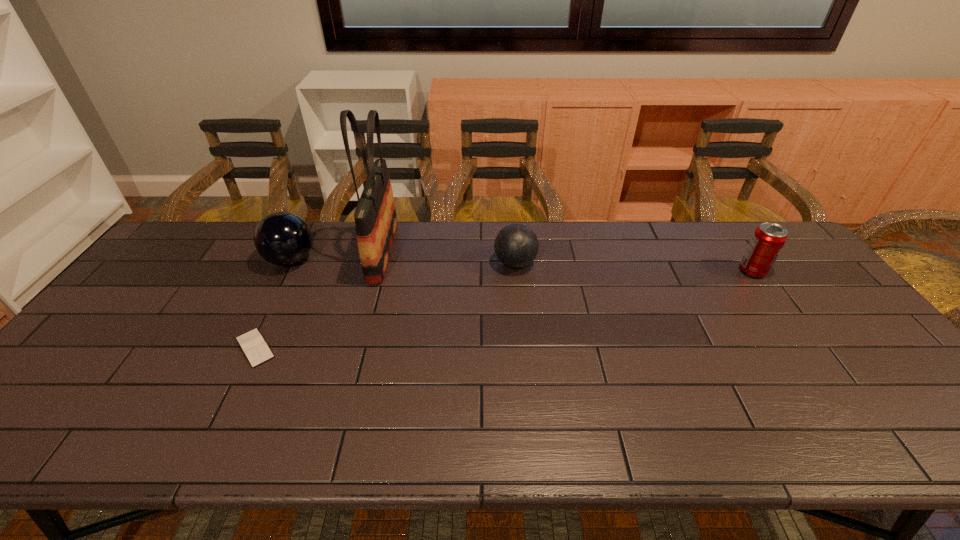
Find the location of a particular element. This screenshot has height=540, width=960. free location located 0.110m on the left of the rightmost object is located at coordinates tap(703, 271).

Locate an element on the screen. This screenshot has height=540, width=960. vacant space located 0.180m on the grip area of the fourth object from left to right is located at coordinates (436, 264).

You are a GUI agent. You are given a task and a screenshot of the screen. Output one action in this format:
    pyautogui.click(x=<x>, y=<y>)
    Task: Click on the vacant space located 0.320m on the grip area of the fourth object from left to right
    The height and width of the screenshot is (540, 960).
    Given the screenshot: What is the action you would take?
    pyautogui.click(x=391, y=264)

Find the location of a particular element. vacant space located 0.220m on the grip area of the fourth object from left to right is located at coordinates (423, 264).

I want to click on free space located on the right of the nearest object, so click(386, 348).

You are a GUI agent. You are given a task and a screenshot of the screen. Output one action in this format:
    pyautogui.click(x=<x>, y=<y>)
    Task: Click on the shopping bag that is at the far edge
    This screenshot has width=960, height=540.
    Given the screenshot: What is the action you would take?
    pyautogui.click(x=375, y=217)

I want to click on soda can that is positioned at the far edge, so click(768, 239).

The width and height of the screenshot is (960, 540). Identify the location of object situated at the right edge. (768, 239).

Where is `object situated at the far right corner`? This screenshot has height=540, width=960. object situated at the far right corner is located at coordinates (768, 239).

Locate an element on the screen. This screenshot has width=960, height=540. vacant space at the far edge of the desktop is located at coordinates (677, 247).